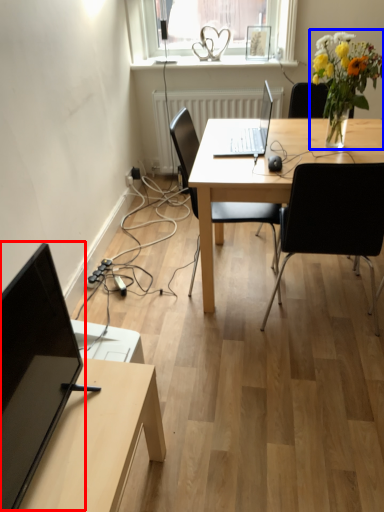
Question: Among these objects, which one is farthest to the camera, computer monitor (highlighted by a red box) or floral arrangement (highlighted by a blue box)?

Choices:
 (A) computer monitor
 (B) floral arrangement

Answer: (B)